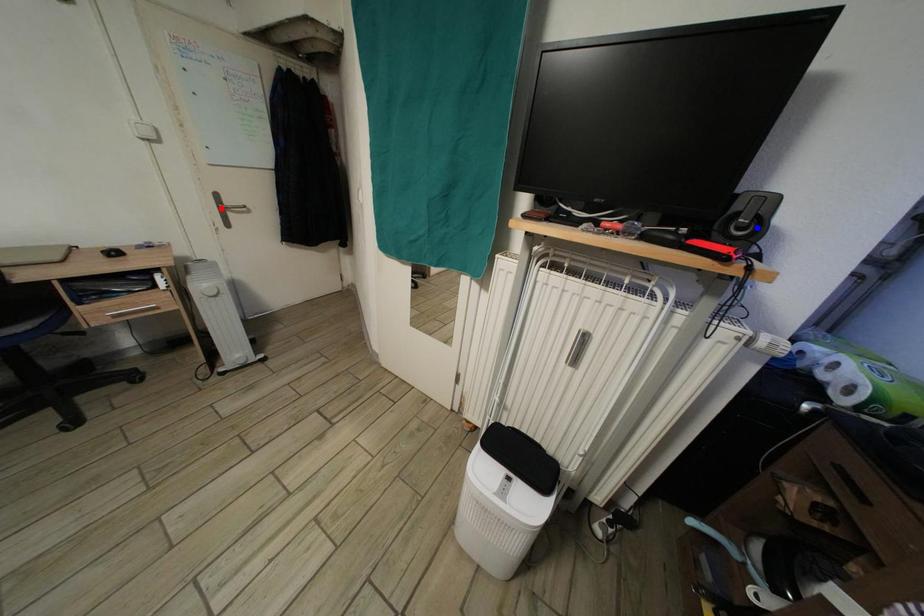
Question: In the image, two points are highlighted. Which point is nearer to the camera? Reply with the corresponding letter.

Choices:
 (A) blue point
 (B) red point

Answer: (A)